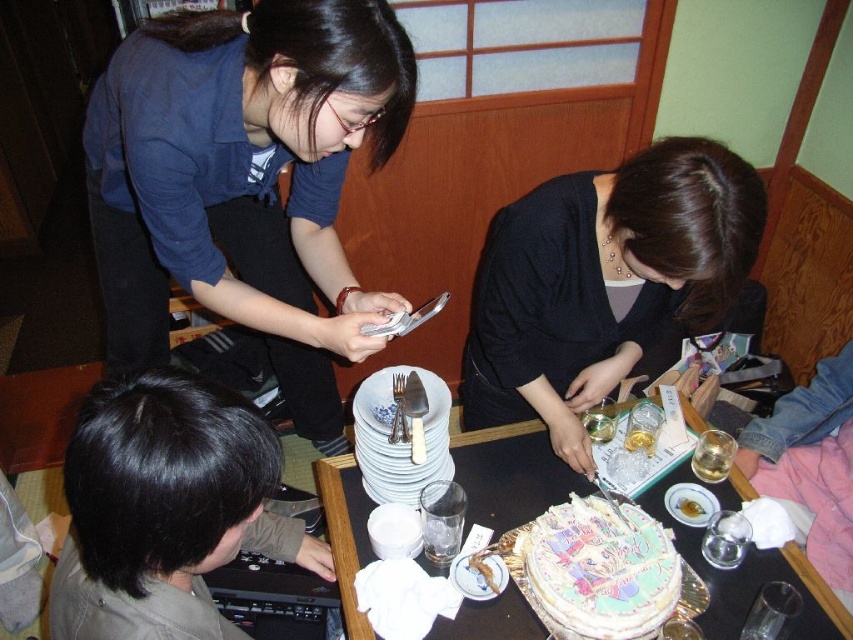
You are a photographer at a party and need to capture a closeup of the decorative paper cake at center. The camera you have can only focus on objects within 25 inches. You see the matte blue shirt at upper left in the background. Will the camera be able to focus on the cake?

The distance between the matte blue shirt at upper left and decorative paper cake at center is 27.25 inches. Since the camera can only focus within 25 inches, the cake is too far away for the camera to focus properly.

You are a guest at this party and want to place a small gift between the decorative paper cake at center and the white paper plate at center. Is there enough space to place it there?

The distance between the decorative paper cake at center and the white paper plate at center is 6.91 inches, so there is enough space to place a small gift between them.

You are a guest at the party and want to take a photo of the decorative paper cake at center without any obstruction. Is the matte blue shirt at upper left blocking your view of it?

The matte blue shirt at upper left is positioned over decorative paper cake at center, so it is blocking the view of the cake. Move the matte blue shirt at upper left to take an unobstructed photo.